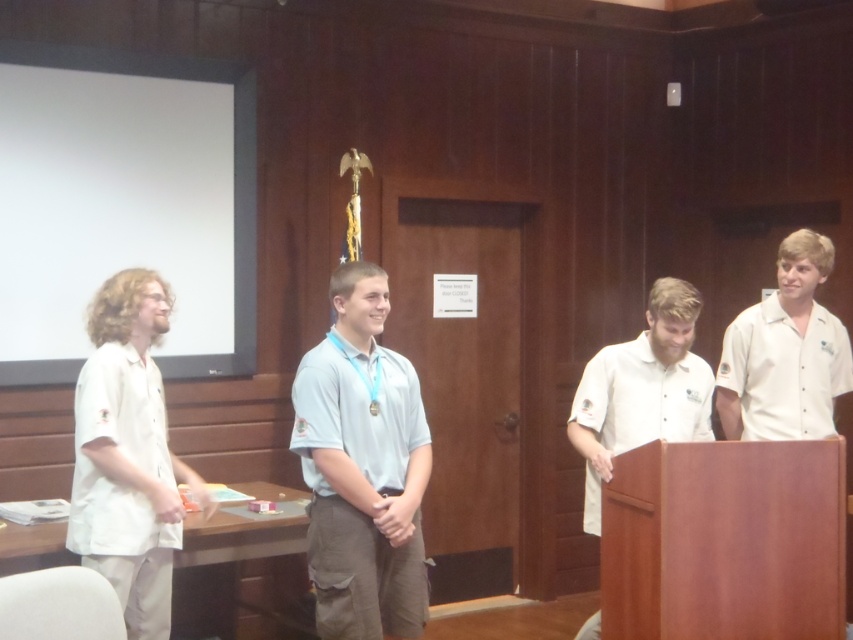
Is point (338, 582) positioned after point (589, 454)?

No, (338, 582) is in front of (589, 454).

You are a GUI agent. You are given a task and a screenshot of the screen. Output one action in this format:
    pyautogui.click(x=<x>, y=<y>)
    Task: Click on the light blue fabric shirt at center
    This screenshot has width=853, height=640.
    Given the screenshot: What is the action you would take?
    pyautogui.click(x=363, y=467)

Who is more forward, (421, 624) or (244, 144)?

Positioned in front is point (421, 624).

Is light blue fabric shirt at center bigger than white matte projection screen at upper left?

No.

Where is `light blue fabric shirt at center`? light blue fabric shirt at center is located at coordinates (363, 467).

Can you confirm if white cotton shirt at right is positioned below white matte projection screen at upper left?

Indeed, white cotton shirt at right is positioned under white matte projection screen at upper left.

Does point (758, 310) lie in front of point (236, 88)?

Yes, point (758, 310) is closer to viewer.

Is point (757, 412) positioned in front of point (229, 355)?

That is True.

Find the location of a particular element. The width and height of the screenshot is (853, 640). white cotton shirt at right is located at coordinates (785, 353).